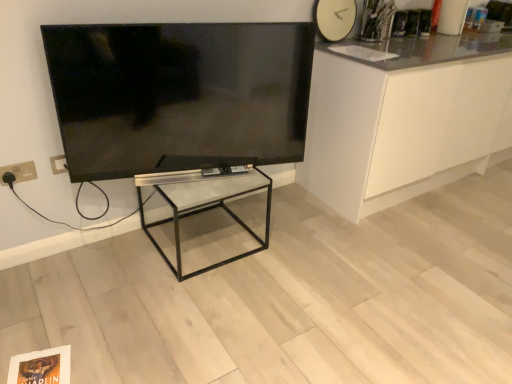
Question: From the image's perspective, is gold metallic electric outlet at lower left on top of white glossy cabinet at right?

Choices:
 (A) no
 (B) yes

Answer: (A)

Question: Is gold metallic electric outlet at lower left outside of white glossy cabinet at right?

Choices:
 (A) no
 (B) yes

Answer: (B)

Question: Is the depth of gold metallic electric outlet at lower left less than that of white glossy cabinet at right?

Choices:
 (A) yes
 (B) no

Answer: (A)

Question: Considering the relative sizes of gold metallic electric outlet at lower left and white glossy cabinet at right in the image provided, is gold metallic electric outlet at lower left wider than white glossy cabinet at right?

Choices:
 (A) no
 (B) yes

Answer: (A)

Question: From a real-world perspective, is gold metallic electric outlet at lower left on top of white glossy cabinet at right?

Choices:
 (A) yes
 (B) no

Answer: (A)

Question: In the image, is flat screen tv at upper left positioned in front of or behind clear glass table at center?

Choices:
 (A) front
 (B) behind

Answer: (A)

Question: Is flat screen tv at upper left taller or shorter than clear glass table at center?

Choices:
 (A) short
 (B) tall

Answer: (B)

Question: In terms of size, does flat screen tv at upper left appear bigger or smaller than clear glass table at center?

Choices:
 (A) big
 (B) small

Answer: (B)

Question: From a real-world perspective, is flat screen tv at upper left above or below clear glass table at center?

Choices:
 (A) above
 (B) below

Answer: (A)

Question: Does point (15, 177) appear closer or farther from the camera than point (328, 56)?

Choices:
 (A) closer
 (B) farther

Answer: (A)

Question: Is gold metallic electric outlet at lower left in front of or behind white glossy cabinet at right in the image?

Choices:
 (A) front
 (B) behind

Answer: (A)

Question: In terms of height, does gold metallic electric outlet at lower left look taller or shorter compared to white glossy cabinet at right?

Choices:
 (A) tall
 (B) short

Answer: (B)

Question: Do you think gold metallic electric outlet at lower left is within white glossy cabinet at right, or outside of it?

Choices:
 (A) outside
 (B) inside

Answer: (A)

Question: Is clear glass table at center spatially inside white glossy cabinet at right, or outside of it?

Choices:
 (A) inside
 (B) outside

Answer: (B)

Question: From a real-world perspective, relative to white glossy cabinet at right, is clear glass table at center vertically above or below?

Choices:
 (A) below
 (B) above

Answer: (A)